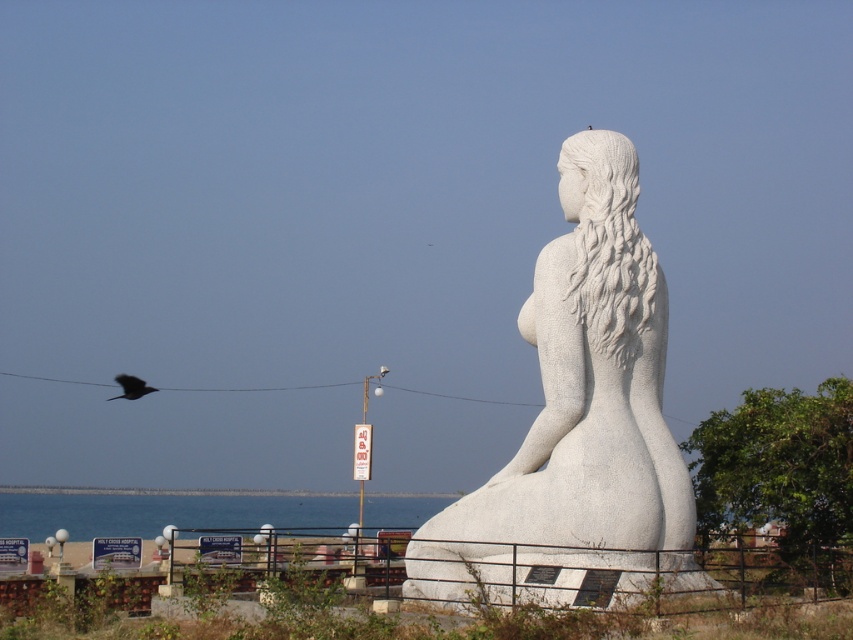
You are standing at the base of the statue and want to take a photo of the point at coordinate (x=589, y=484). If the camera you are using has a maximum focus range of 200 feet, will you be able to focus on that point?

The distance of point (x=589, y=484) from camera is 216.64 feet, which exceeds the camera maximum focus range of 200 feet. Therefore, the camera will not be able to focus on that point.

You are an art student observing the white stone statue at center and the dark feathered bird at upper left. Which object appears taller in the image?

The white stone statue at center appears taller than the dark feathered bird at upper left.